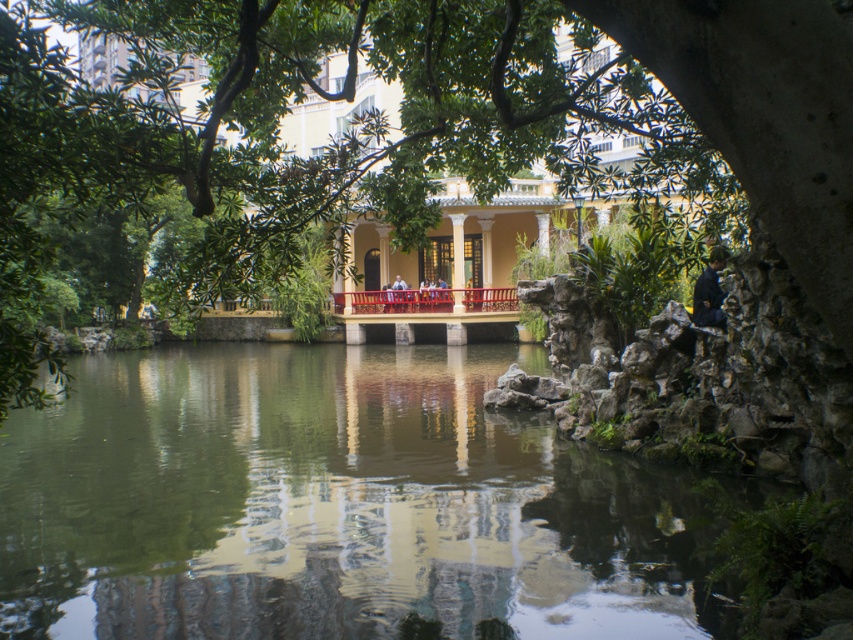
Does green reflective water at center have a greater width compared to metallic red railing at center?

Yes, green reflective water at center is wider than metallic red railing at center.

Between green reflective water at center and metallic red railing at center, which one is positioned lower?

green reflective water at center is lower down.

Who is more forward, (x=281, y=634) or (x=374, y=312)?

Point (x=281, y=634)

Locate an element on the screen. green reflective water at center is located at coordinates (338, 504).